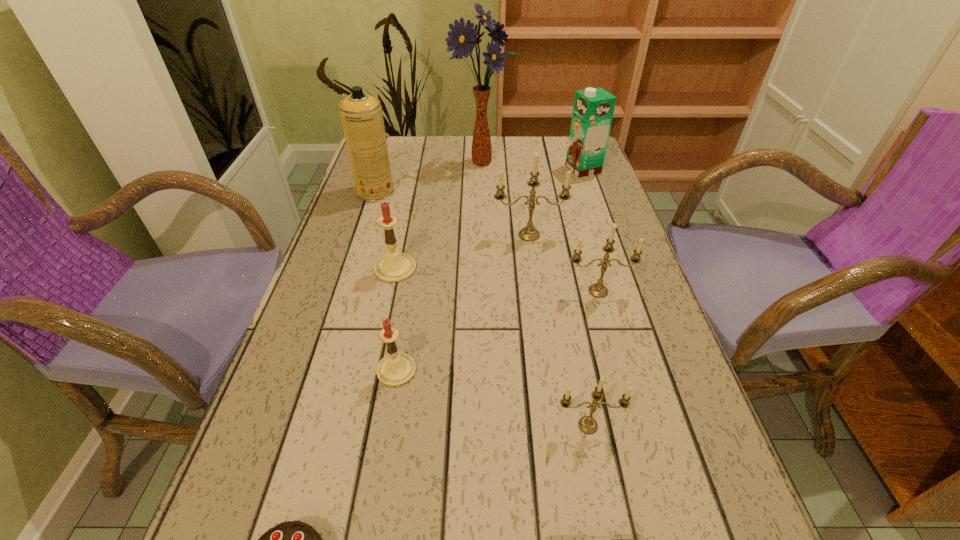
Select which object is the seventh closest to the smallest metallic candle. Please provide its 2D coordinates. Your answer should be formatted as a tuple, i.e. [(x, y)], where the tuple contains the x and y coordinates of a point satisfying the conditions above.

[(361, 115)]

Identify which candle is located as the third nearest to the farthest metallic candle. Please provide its 2D coordinates. Your answer should be formatted as a tuple, i.e. [(x, y)], where the tuple contains the x and y coordinates of a point satisfying the conditions above.

[(396, 369)]

Identify the location of candle that is the second closest to the second tallest object. (529, 233).

Identify which metallic candle is the second nearest to the tallest object. Please provide its 2D coordinates. Your answer should be formatted as a tuple, i.e. [(x, y)], where the tuple contains the x and y coordinates of a point satisfying the conditions above.

[(598, 290)]

Identify which metallic candle is the second nearest to the nearer red candle. Please provide its 2D coordinates. Your answer should be formatted as a tuple, i.e. [(x, y)], where the tuple contains the x and y coordinates of a point satisfying the conditions above.

[(598, 290)]

Locate an element on the screen. This screenshot has height=540, width=960. vacant space that satisfies the following two spatial constraints: 1. on the back side of the bigger red candle; 2. on the right side of the flower arrangement is located at coordinates (418, 161).